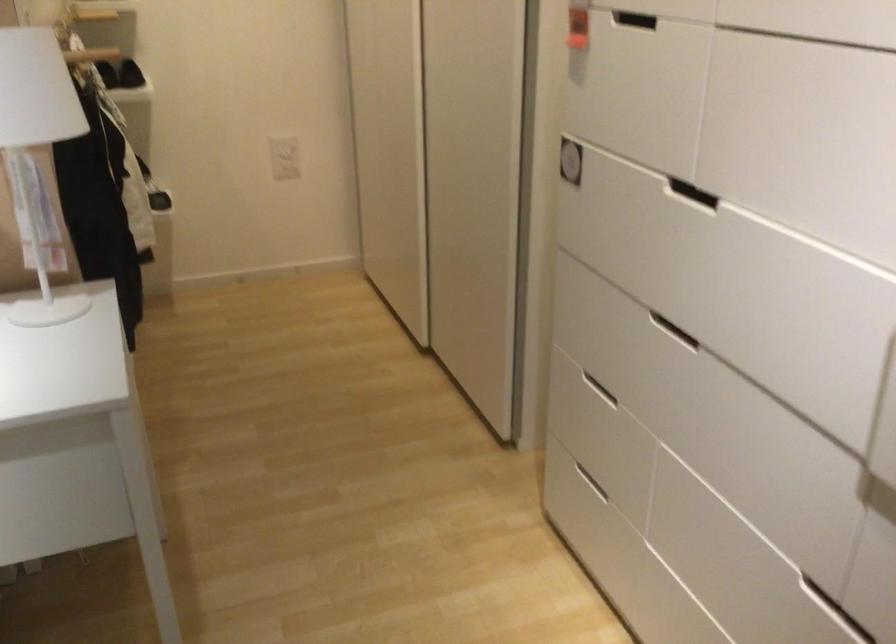
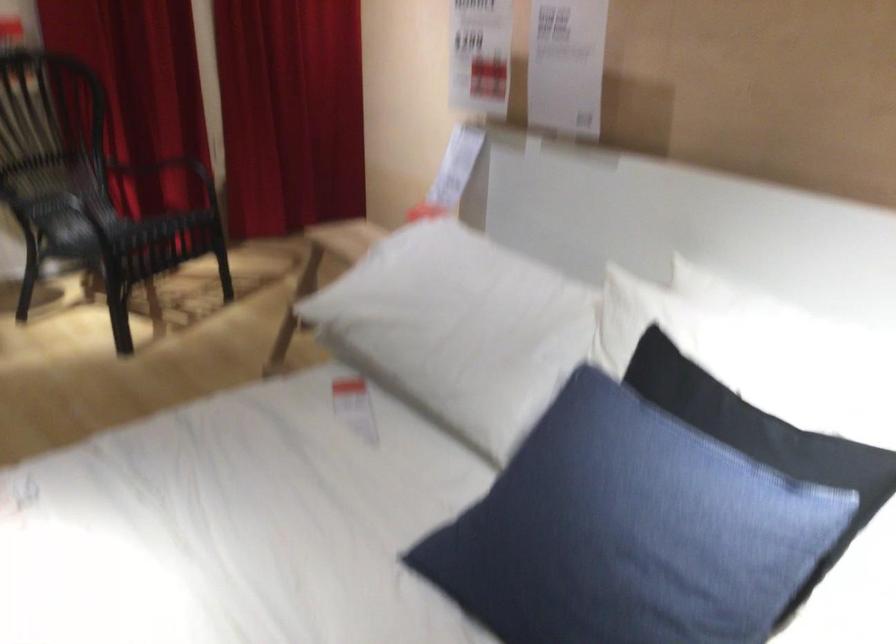
Question: The camera is either moving clockwise (left) or counter-clockwise (right) around the object. The first image is from the beginning of the video and the second image is from the end. Is the camera moving left or right when shooting the video?

Choices:
 (A) Left
 (B) Right

Answer: (B)